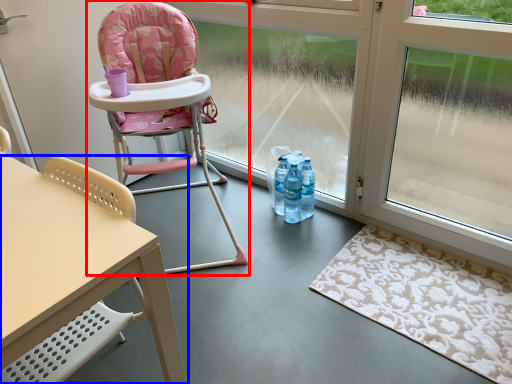
Question: Which object appears farthest to the camera in this image, chair (highlighted by a red box) or chair (highlighted by a blue box)?

Choices:
 (A) chair
 (B) chair

Answer: (A)